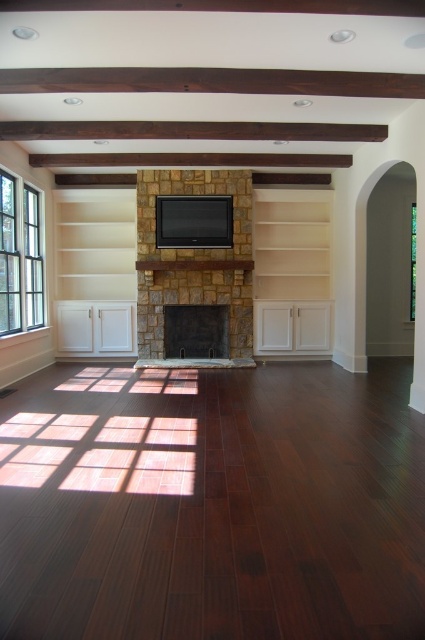
Does point (147, 216) lie in front of point (201, 346)?

Yes, it is in front of point (201, 346).

Does stone fireplace at center have a greater height compared to black stone fireplace at center?

Correct, stone fireplace at center is much taller as black stone fireplace at center.

Identify the location of stone fireplace at center. (193, 259).

Who is positioned more to the right, stone fireplace at center or clear glass window at right?

From the viewer's perspective, clear glass window at right appears more on the right side.

Does point (238, 340) come behind point (411, 307)?

No.

At what (x,y) coordinates should I click in order to perform the action: click on stone fireplace at center. Please return your answer as a coordinate pair (x, y). This screenshot has width=425, height=640. Looking at the image, I should click on (193, 259).

Does stone fireplace at center appear on the right side of clear glass window at left?

Yes, stone fireplace at center is to the right of clear glass window at left.

This screenshot has height=640, width=425. What do you see at coordinates (193, 259) in the screenshot?
I see `stone fireplace at center` at bounding box center [193, 259].

Find the location of a particular element. stone fireplace at center is located at coordinates (193, 259).